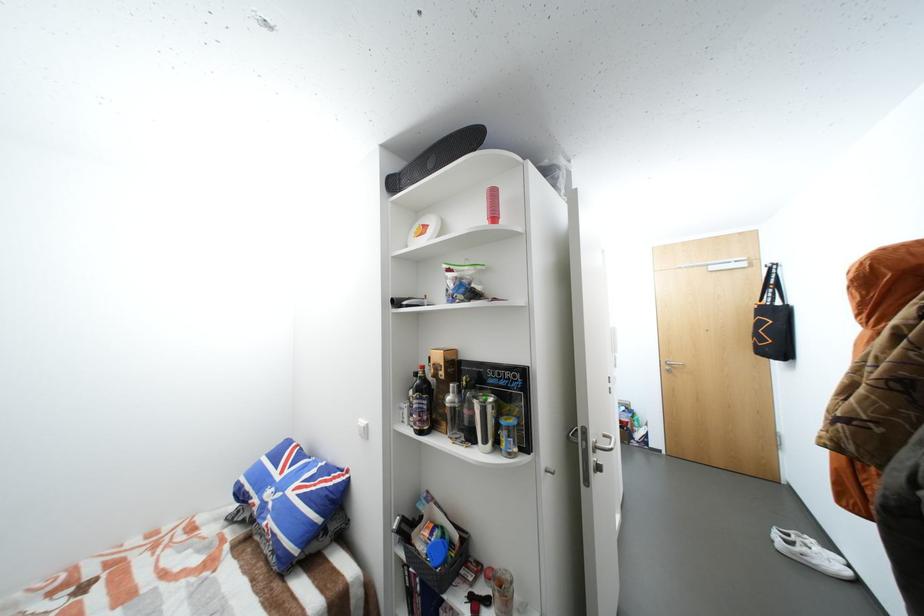
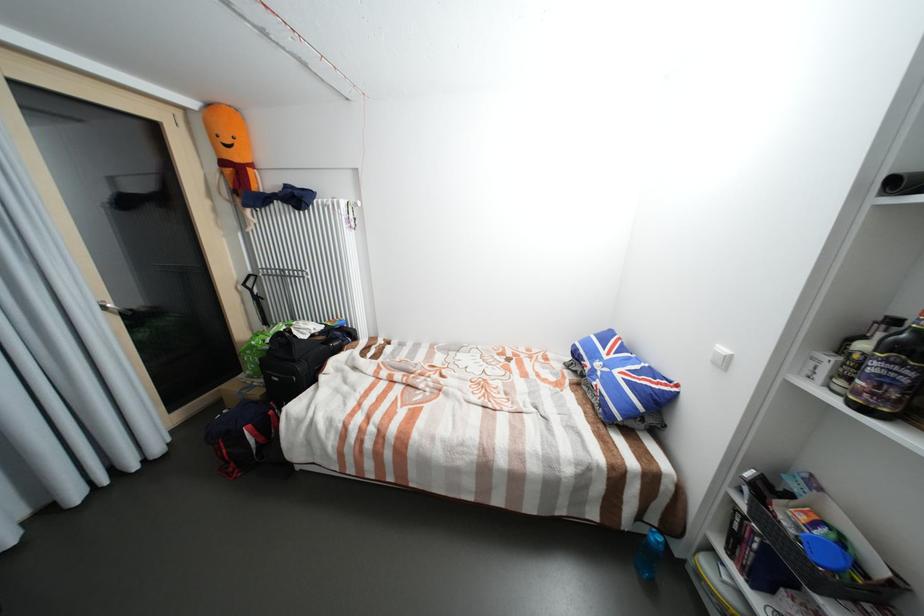
In the second image, find the point that corresponds to (x=444, y=562) in the first image.

(828, 560)